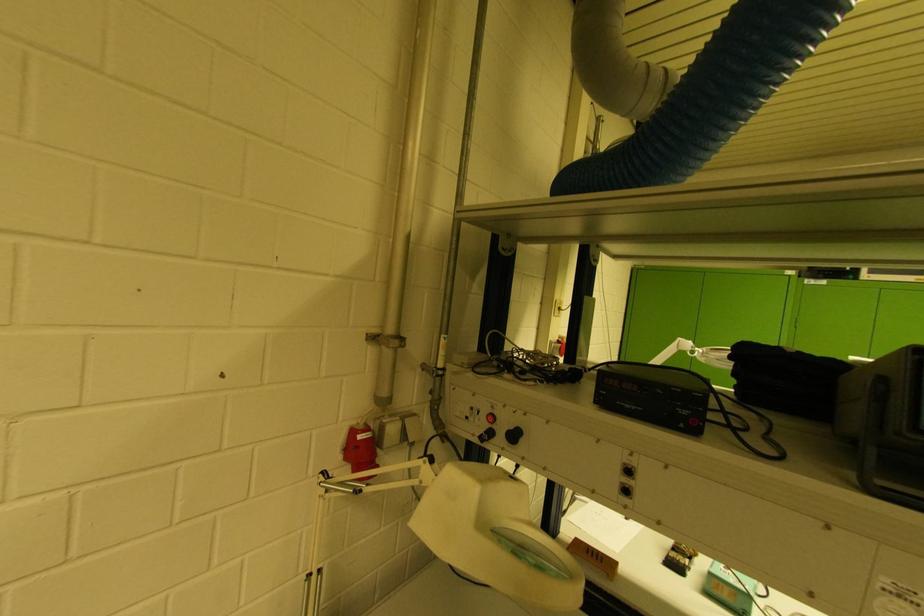
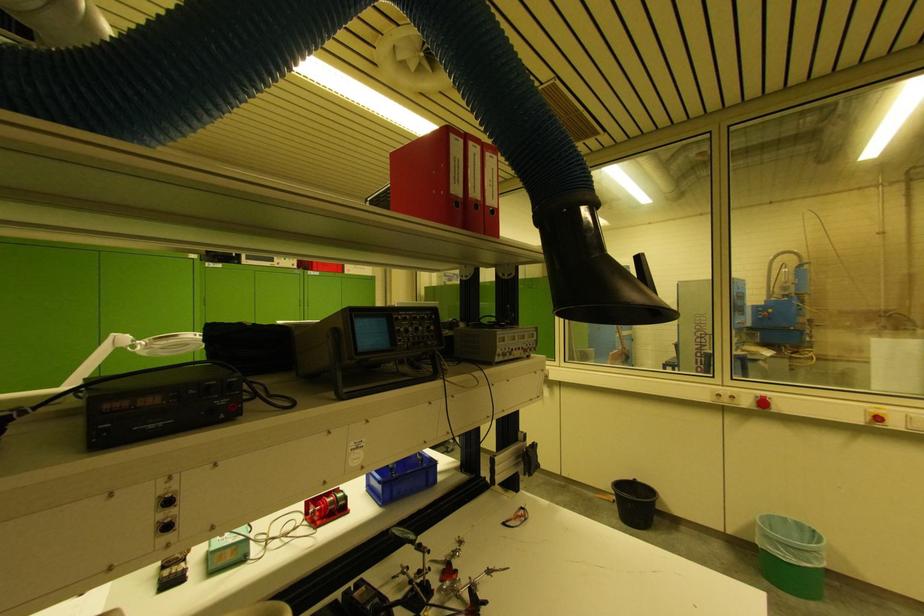
Question: The first image is from the beginning of the video and the second image is from the end. How did the camera likely rotate when shooting the video?

Choices:
 (A) Left
 (B) Right
 (C) Up
 (D) Down

Answer: (B)